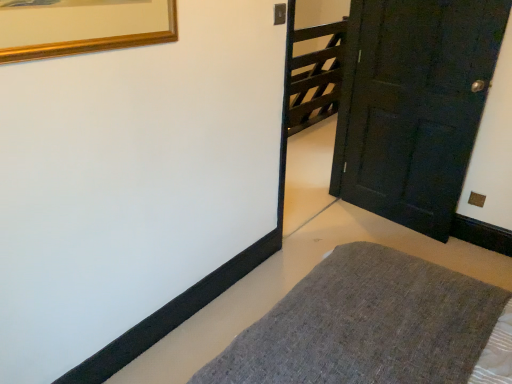
You are a GUI agent. You are given a task and a screenshot of the screen. Output one action in this format:
    pyautogui.click(x=<x>, y=<y>)
    Task: Click on the textured gray rug at lower center
    
    Given the screenshot: What is the action you would take?
    pyautogui.click(x=374, y=327)

In terms of height, does matte black door at right look taller or shorter compared to dark wood gate at upper right?

Clearly, matte black door at right is taller compared to dark wood gate at upper right.

Can you tell me how much matte black door at right and dark wood gate at upper right differ in facing direction?

The facing directions of matte black door at right and dark wood gate at upper right are 95.9 degrees apart.

Locate an element on the screen. The height and width of the screenshot is (384, 512). door in front of the dark wood gate at upper right is located at coordinates (413, 105).

Which is farther from the camera, (377, 351) or (455, 61)?

The point (455, 61) is behind.

Is textured gray rug at lower center shorter than matte black door at right?

Indeed, textured gray rug at lower center has a lesser height compared to matte black door at right.

Which of these two, textured gray rug at lower center or matte black door at right, is bigger?

Bigger between the two is textured gray rug at lower center.

Locate an element on the screen. stairwell that appears above the matte black door at right (from the image's perspective) is located at coordinates (316, 76).

From a real-world perspective, does dark wood gate at upper right stand above matte black door at right?

No, from a real-world perspective, dark wood gate at upper right is not above matte black door at right.

Can you see dark wood gate at upper right touching matte black door at right?

No, dark wood gate at upper right is not with matte black door at right.

Between dark wood gate at upper right and matte black door at right, which one has less height?

dark wood gate at upper right.

Where is `furniture on the left of matte black door at right`? Image resolution: width=512 pixels, height=384 pixels. furniture on the left of matte black door at right is located at coordinates pyautogui.click(x=374, y=327).

Does matte black door at right touch textured gray rug at lower center?

No, matte black door at right is not beside textured gray rug at lower center.

In the scene shown: Is matte black door at right positioned before textured gray rug at lower center?

That is False.

Can you confirm if matte black door at right is taller than textured gray rug at lower center?

Yes.

Which is closer, (x=449, y=371) or (x=290, y=94)?

Clearly, point (x=449, y=371) is closer to the camera than point (x=290, y=94).

Which of these two, textured gray rug at lower center or dark wood gate at upper right, stands shorter?

Standing shorter between the two is textured gray rug at lower center.

Are textured gray rug at lower center and dark wood gate at upper right beside each other?

textured gray rug at lower center and dark wood gate at upper right are clearly separated.

Between dark wood gate at upper right and textured gray rug at lower center, which one appears on the left side from the viewer's perspective?

textured gray rug at lower center.

Which object is wider, dark wood gate at upper right or textured gray rug at lower center?

textured gray rug at lower center.

The width and height of the screenshot is (512, 384). I want to click on stairwell positioned vertically above the textured gray rug at lower center (from a real-world perspective), so click(316, 76).

Image resolution: width=512 pixels, height=384 pixels. In the image, there is a dark wood gate at upper right. What are the coordinates of `door below it (from the image's perspective)` in the screenshot? It's located at 413,105.

This screenshot has width=512, height=384. Identify the location of furniture in front of the matte black door at right. (374, 327).

From the image, which object appears to be farther from textured gray rug at lower center, dark wood gate at upper right or matte black door at right?

dark wood gate at upper right is further to textured gray rug at lower center.

From the image, which object appears to be farther from dark wood gate at upper right, textured gray rug at lower center or matte black door at right?

Based on the image, textured gray rug at lower center appears to be further to dark wood gate at upper right.

Based on their spatial positions, is textured gray rug at lower center or dark wood gate at upper right closer to matte black door at right?

The object closer to matte black door at right is textured gray rug at lower center.

Considering their positions, is matte black door at right positioned closer to textured gray rug at lower center than dark wood gate at upper right?

Based on the image, matte black door at right appears to be nearer to textured gray rug at lower center.

Considering their positions, is matte black door at right positioned further to dark wood gate at upper right than textured gray rug at lower center?

textured gray rug at lower center is positioned further to the anchor dark wood gate at upper right.

Considering their positions, is dark wood gate at upper right positioned closer to matte black door at right than textured gray rug at lower center?

textured gray rug at lower center.

Locate an element on the screen. This screenshot has height=384, width=512. door between textured gray rug at lower center and dark wood gate at upper right from front to back is located at coordinates (413, 105).